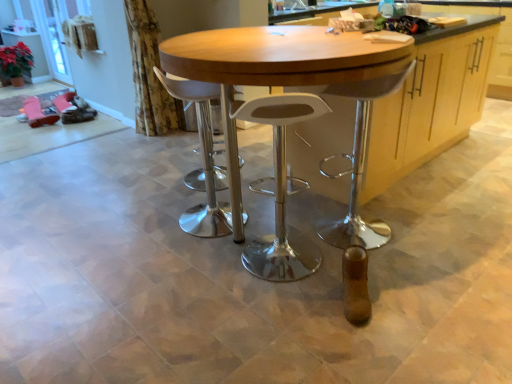
The width and height of the screenshot is (512, 384). Identify the location of vacant space in front of white plastic stool at center, arranged as the second stool when viewed from the right. (192, 257).